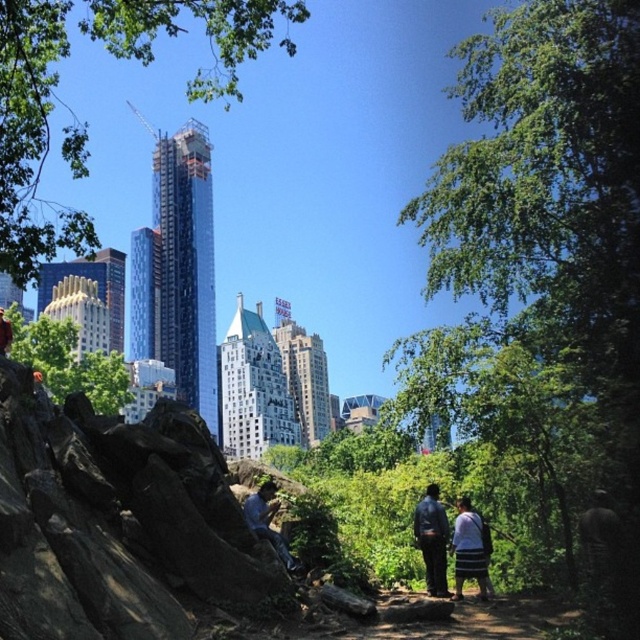
Question: Is green leafy tree at left behind striped fabric skirt at lower center?

Choices:
 (A) yes
 (B) no

Answer: (A)

Question: Estimate the real-world distances between objects in this image. Which object is farther from the denim jacket at lower right?

Choices:
 (A) green leafy tree at upper left
 (B) blue denim jeans at center

Answer: (A)

Question: Does green leafy tree at left appear on the left side of blue denim jeans at center?

Choices:
 (A) yes
 (B) no

Answer: (A)

Question: Among these objects, which one is farthest from the camera?

Choices:
 (A) dark blue leather jacket at center
 (B) green leafy tree at upper left

Answer: (A)

Question: Estimate the real-world distances between objects in this image. Which object is farther from the green leafy tree at left?

Choices:
 (A) green leafy tree at upper left
 (B) dark blue leather jacket at center
 (C) striped fabric skirt at lower center
 (D) blue denim jeans at center

Answer: (C)

Question: Is green leafy tree at upper left wider than green leafy tree at left?

Choices:
 (A) no
 (B) yes

Answer: (B)